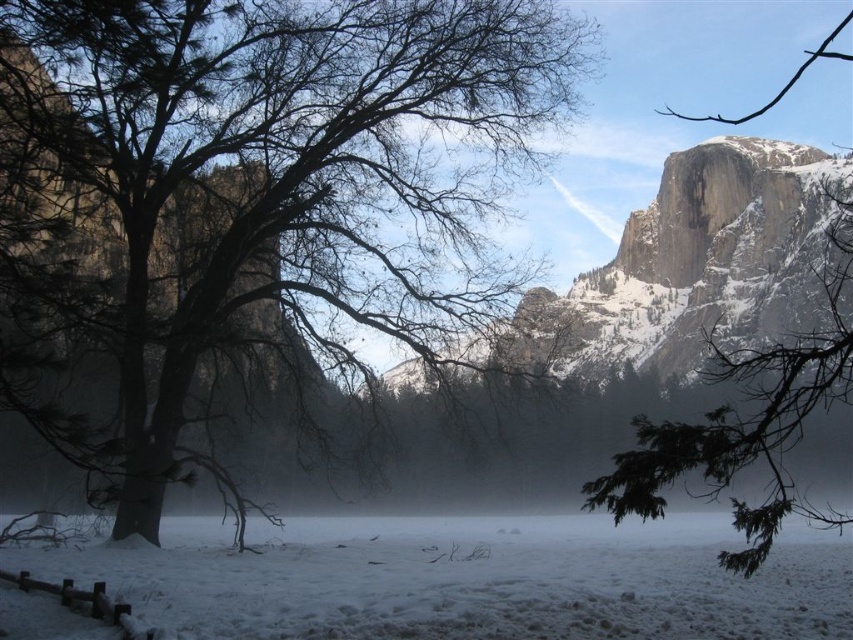
Is white snow at center shorter than green leafy branch at upper right?

Correct, white snow at center is not as tall as green leafy branch at upper right.

Between white snow at center and green leafy branch at upper right, which one appears on the left side from the viewer's perspective?

From the viewer's perspective, white snow at center appears more on the left side.

Is point (720, 540) farther from viewer compared to point (763, 392)?

Yes, it is behind point (763, 392).

Identify the location of white snow at center. The width and height of the screenshot is (853, 640). (469, 579).

Between point (65, 420) and point (755, 605), which one is positioned behind?

Point (755, 605)

Between point (50, 282) and point (173, 541), which one is positioned in front?

Point (50, 282) is more forward.

Is point (12, 129) farther from viewer compared to point (801, 531)?

No.

Identify the location of brown/dry wood tree at left. (254, 188).

Is brown/dry wood tree at left behind green leafy branch at upper right?

Yes, brown/dry wood tree at left is further from the viewer.

You are a GUI agent. You are given a task and a screenshot of the screen. Output one action in this format:
    pyautogui.click(x=<x>, y=<y>)
    Task: Click on the brown/dry wood tree at left
    This screenshot has width=853, height=640.
    Given the screenshot: What is the action you would take?
    pyautogui.click(x=254, y=188)